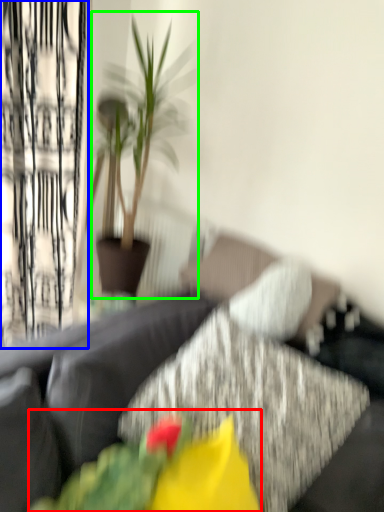
Question: Considering the real-world distances, which object is closest to floral arrangement (highlighted by a red box)? curtain (highlighted by a blue box) or houseplant (highlighted by a green box).

Choices:
 (A) curtain
 (B) houseplant

Answer: (B)